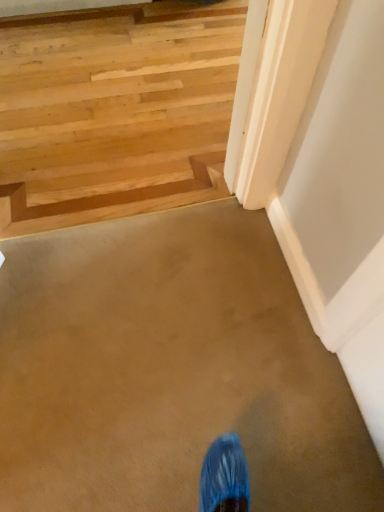
Question: From a real-world perspective, is natural wood stairs at upper left physically located above or below light brown wood at upper left?

Choices:
 (A) above
 (B) below

Answer: (B)

Question: From the image's perspective, is natural wood stairs at upper left above or below light brown wood at upper left?

Choices:
 (A) below
 (B) above

Answer: (B)

Question: Is point (41, 74) positioned closer to the camera than point (215, 163)?

Choices:
 (A) farther
 (B) closer

Answer: (A)

Question: In the image, is light brown wood at upper left on the left side or the right side of natural wood stairs at upper left?

Choices:
 (A) left
 (B) right

Answer: (A)

Question: Is point (177, 200) positioned closer to the camera than point (34, 75)?

Choices:
 (A) closer
 (B) farther

Answer: (A)

Question: Considering their positions, is light brown wood at upper left located in front of or behind natural wood stairs at upper left?

Choices:
 (A) front
 (B) behind

Answer: (B)

Question: From the image's perspective, is light brown wood at upper left above or below natural wood stairs at upper left?

Choices:
 (A) below
 (B) above

Answer: (A)